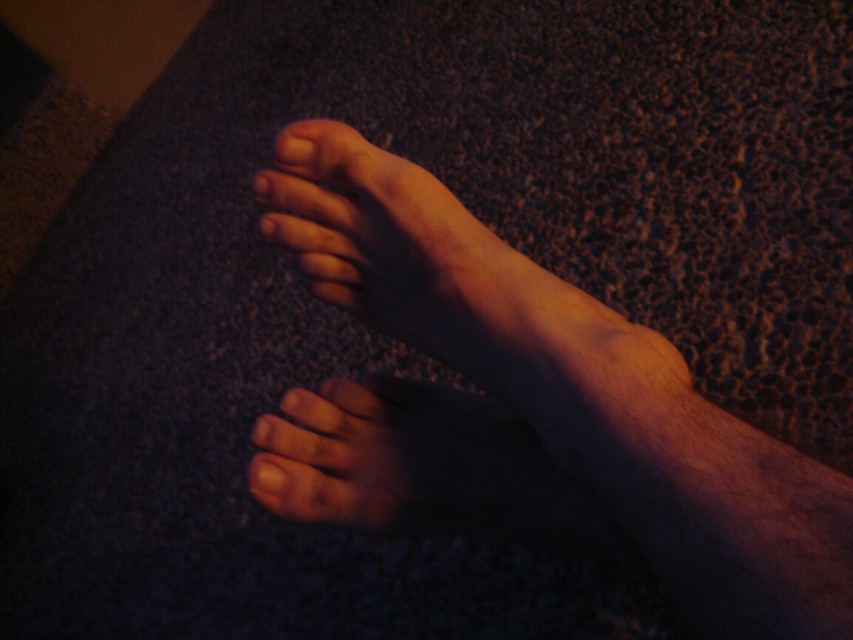
Does skinny bare feet at center appear under matte skin toe at upper center?

Yes.

Where is `skinny bare feet at center`? This screenshot has width=853, height=640. skinny bare feet at center is located at coordinates (537, 419).

Is point (822, 552) in front of point (281, 145)?

Yes.

Find the location of a particular element. Image resolution: width=853 pixels, height=640 pixels. skinny bare feet at center is located at coordinates (537, 419).

Can you confirm if dry skin at lower left is shorter than matte skin toe at upper center?

No.

Is point (339, 433) in front of point (326, 131)?

No.

What are the coordinates of `dry skin at lower left` in the screenshot? It's located at (402, 461).

Find the location of a particular element. dry skin at lower left is located at coordinates (402, 461).

Can you confirm if skinny bare feet at center is bigger than dry skin at lower left?

Indeed, skinny bare feet at center has a larger size compared to dry skin at lower left.

Can you confirm if skinny bare feet at center is positioned below dry skin at lower left?

No.

The image size is (853, 640). Describe the element at coordinates (537, 419) in the screenshot. I see `skinny bare feet at center` at that location.

Locate an element on the screen. skinny bare feet at center is located at coordinates (x=537, y=419).